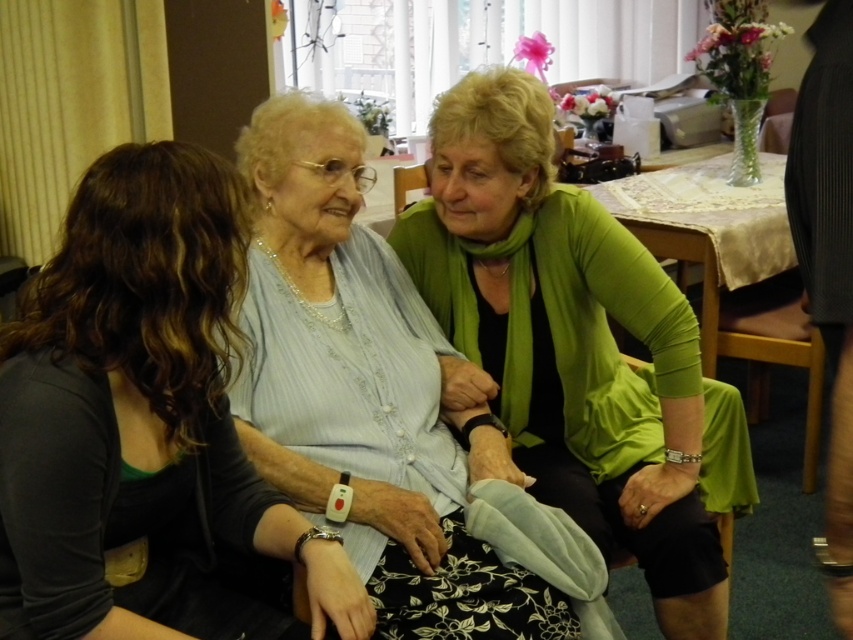
Question: Observing the image, what is the correct spatial positioning of light blue fabric at center in reference to wooden chair at center?

Choices:
 (A) below
 (B) above

Answer: (A)

Question: Estimate the real-world distances between objects in this image. Which object is closer to the light blue fabric at center?

Choices:
 (A) matte gray sweater at center
 (B) green matte cardigan at center

Answer: (B)

Question: Can you confirm if matte gray sweater at center is positioned to the left of wooden chair at center?

Choices:
 (A) yes
 (B) no

Answer: (A)

Question: Is green matte cardigan at center closer to the viewer compared to matte gray sweater at center?

Choices:
 (A) no
 (B) yes

Answer: (A)

Question: Which point appears closest to the camera in this image?

Choices:
 (A) (692, 369)
 (B) (399, 166)
 (C) (196, 433)
 (D) (373, 429)

Answer: (C)

Question: Which of the following is the farthest from the observer?

Choices:
 (A) green matte cardigan at center
 (B) wooden chair at center

Answer: (B)